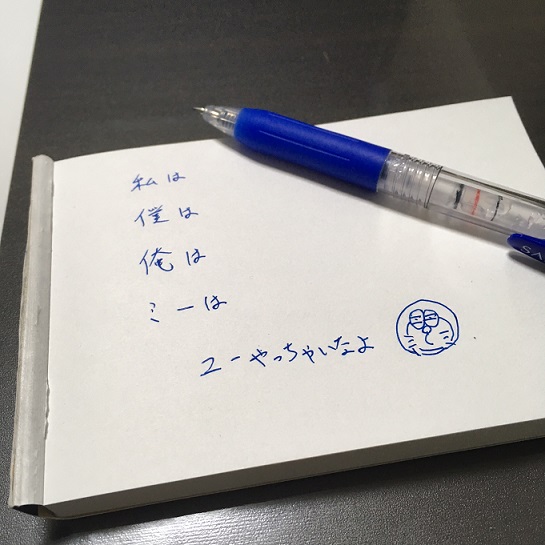
This screenshot has width=545, height=545. What are the coordinates of `writing surface` in the screenshot? It's located at (155, 105).